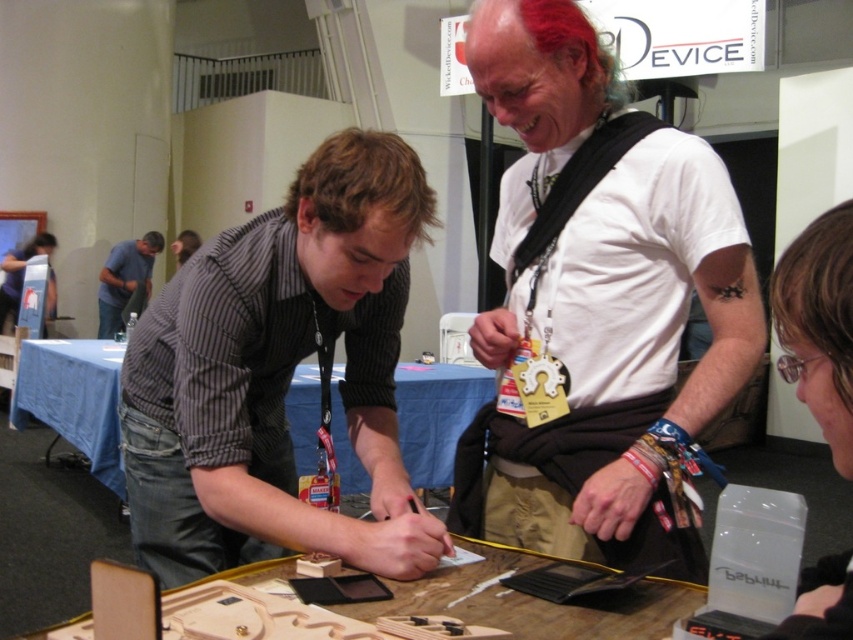
Based on the scene description, what object corresponds to the coordinates point (599, 305)?

The white matte shirt at center corresponds to the coordinates point (599, 305).

You are attending an event and want to get a drink from the water bottle. You see the brushed metal water at bottle left and the smooth black shirt at center. Which object is lower in position?

The brushed metal water at bottle left is located below the smooth black shirt at center, so the water bottle is lower.

You are organizing a clothing display and need to arrange the white matte shirt at center and the smooth black shirt at center side by side. Which shirt should you place on the left to ensure they fit within a 1.2 meter wide display area?

The white matte shirt at center has a smaller width than the smooth black shirt at center. To fit both within the 1.2 meter display area, place the wider smooth black shirt at center on the left and the narrower white matte shirt at center on the right, ensuring the total width does not exceed the available space.